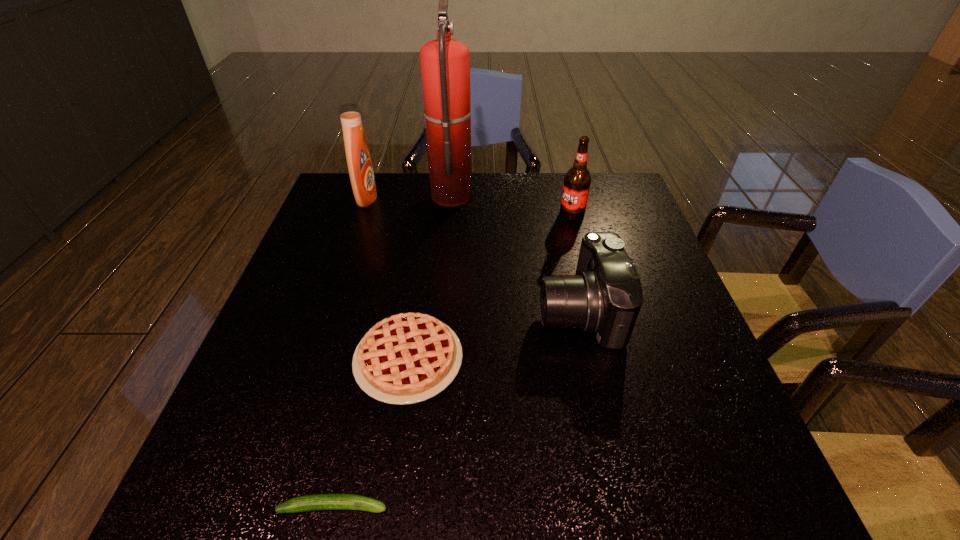
You are a GUI agent. You are given a task and a screenshot of the screen. Output one action in this format:
    pyautogui.click(x=<x>, y=<y>)
    Task: Click on the free space located 0.320m on the lens of the fourth tallest object
    
    Given the screenshot: What is the action you would take?
    pyautogui.click(x=397, y=310)

You are a GUI agent. You are given a task and a screenshot of the screen. Output one action in this format:
    pyautogui.click(x=<x>, y=<y>)
    Task: Click on the free space located on the lens of the fourth tallest object
    
    Given the screenshot: What is the action you would take?
    pyautogui.click(x=375, y=310)

Where is `free point located on the lens of the fourth tallest object`? The height and width of the screenshot is (540, 960). free point located on the lens of the fourth tallest object is located at coordinates (464, 310).

Locate an element on the screen. The image size is (960, 540). vacant space located on the right of the pie is located at coordinates (649, 360).

This screenshot has width=960, height=540. I want to click on free region located 0.310m on the front-facing side of the zucchini, so click(585, 507).

Where is `fire extinguisher that is at the far edge`? The height and width of the screenshot is (540, 960). fire extinguisher that is at the far edge is located at coordinates (445, 63).

Identify the location of detergent situated at the far edge. This screenshot has height=540, width=960. (359, 163).

In order to click on root beer that is positioned at the far edge in this screenshot , I will do `click(577, 180)`.

Where is `object present at the near edge`? object present at the near edge is located at coordinates (319, 501).

Locate an element on the screen. detergent located in the left edge section of the desktop is located at coordinates (359, 163).